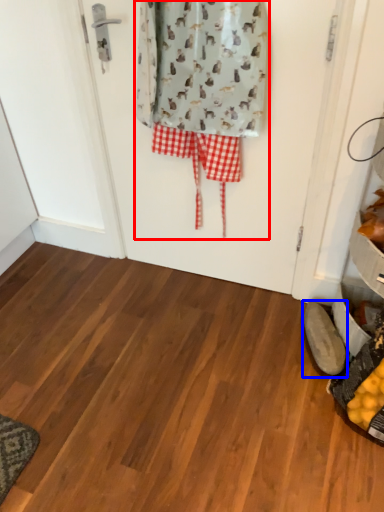
Question: Which point is closer to the camera, laundry (highlighted by a red box) or footwear (highlighted by a blue box)?

Choices:
 (A) laundry
 (B) footwear

Answer: (A)